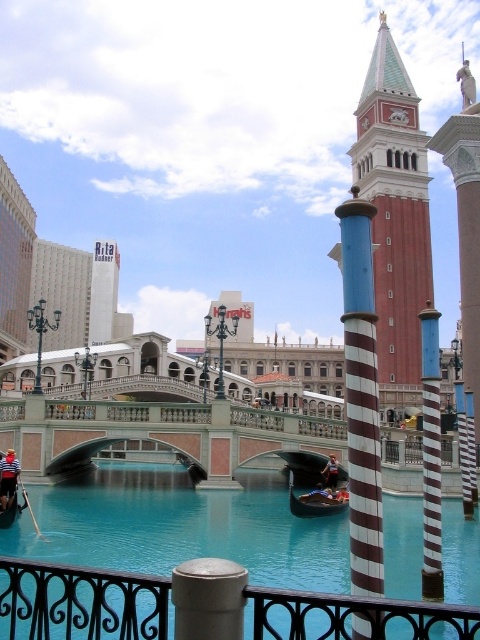
Question: Which object is positioned closest to the black metal railing at lower center?

Choices:
 (A) blue and white striped pole at center
 (B) reddish-brown leather jacket at lower center

Answer: (A)

Question: Does teal glossy waterway at center have a lesser width compared to white sign at upper left?

Choices:
 (A) yes
 (B) no

Answer: (B)

Question: Considering the real-world distances, which object is closest to the blue striped pole at center?

Choices:
 (A) blue and white striped pole at center
 (B) white sign at upper left

Answer: (A)

Question: Does blue striped pole at center appear under reddish-brown leather jacket at lower center?

Choices:
 (A) yes
 (B) no

Answer: (B)

Question: Estimate the real-world distances between objects in this image. Which object is farther from the reddish-brown leather jacket at lower center?

Choices:
 (A) marble bridge at center
 (B) blue and white striped pole at center
 (C) teal glossy waterway at center
 (D) white sign at upper left

Answer: (D)

Question: Does white sign at upper left appear over rubber boat at center?

Choices:
 (A) yes
 (B) no

Answer: (A)